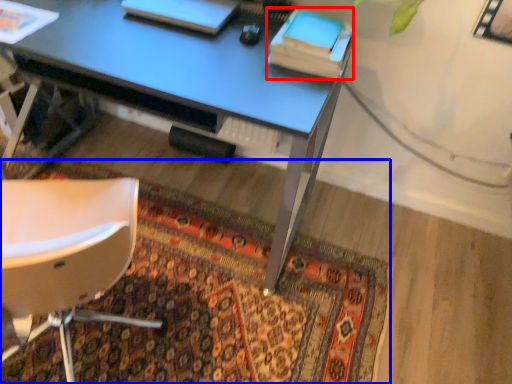
Question: Which point is further to the camera, book (highlighted by a red box) or mat (highlighted by a blue box)?

Choices:
 (A) book
 (B) mat

Answer: (A)